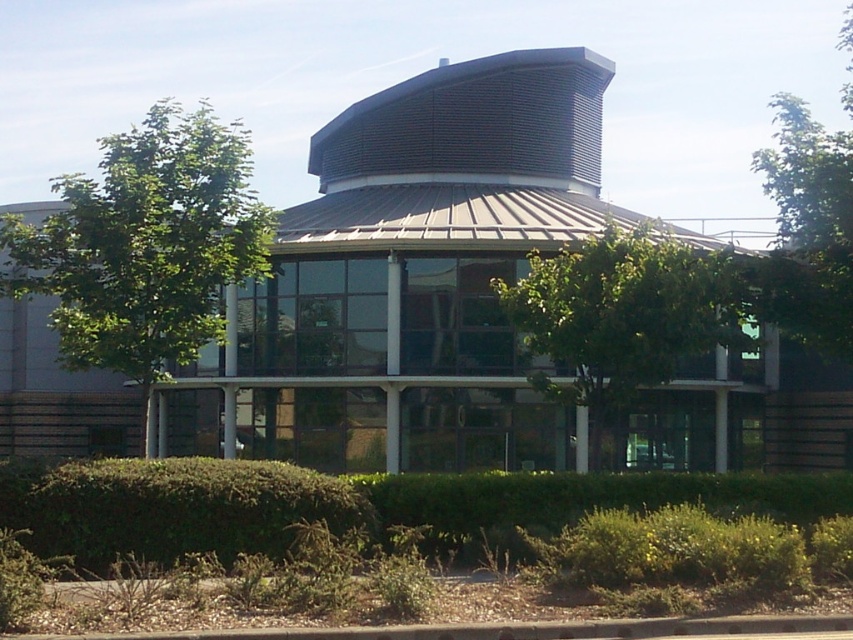
You are a landscape architect planning to trim the green leafy tree at center and the green leafy tree at upper right. Which tree requires more pruning to maintain a uniform size with the other?

The green leafy tree at upper right requires more pruning because it is larger than the green leafy tree at center.

You are standing in front of the modern architectural structure and want to take a photo of the green leafy tree at left. Where should you position yourself to capture it in the frame?

The green leafy tree at left is located at point (144, 246), so you should position yourself to the left side of the structure to include it in your photo.